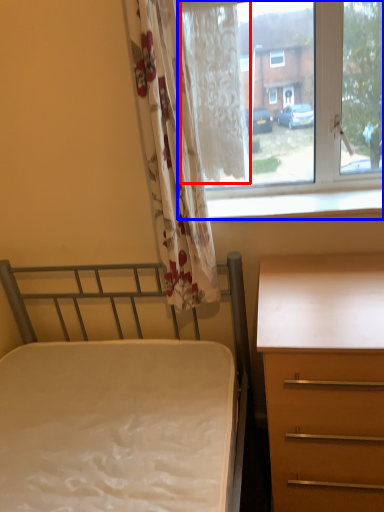
Question: Which point is closer to the camera, curtain (highlighted by a red box) or window (highlighted by a blue box)?

Choices:
 (A) curtain
 (B) window

Answer: (B)